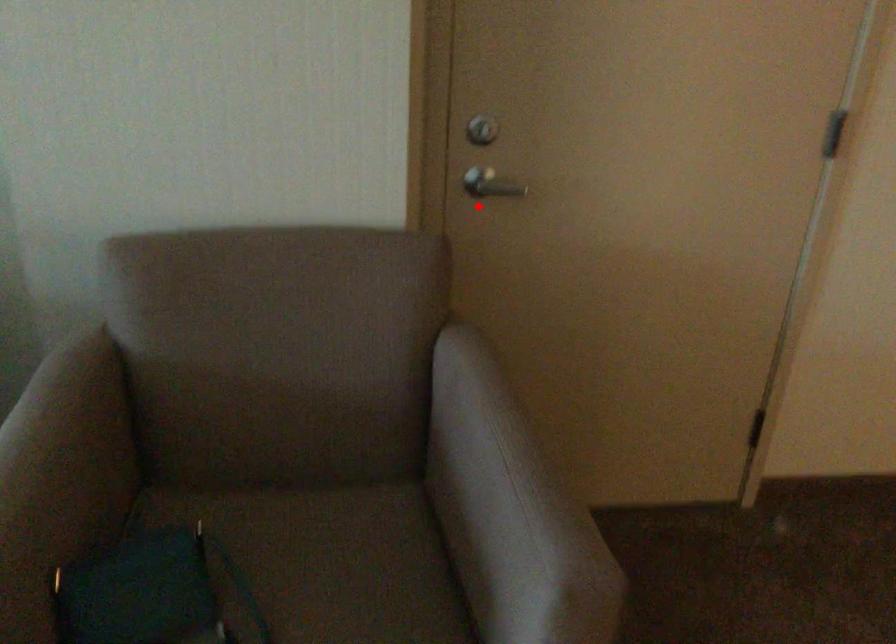
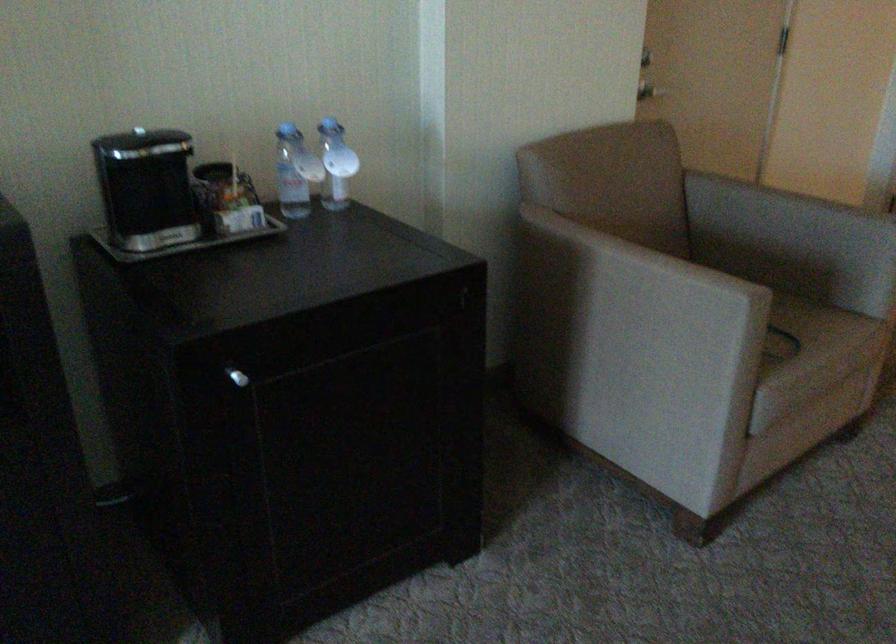
Question: I am providing you with two images of the same scene from different viewpoints. Image1 has a red point marked. In image2, the corresponding 3D location appears at what relative position? Reply with the corresponding letter.

Choices:
 (A) Closer
 (B) Farther

Answer: (B)